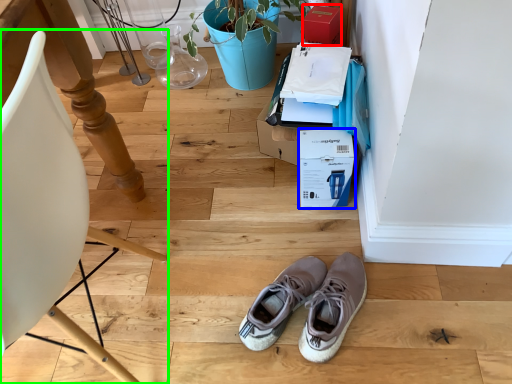
Question: Which is nearer to the cardboard box (highlighted by a red box)? cardboard box (highlighted by a blue box) or chair (highlighted by a green box).

Choices:
 (A) cardboard box
 (B) chair

Answer: (A)